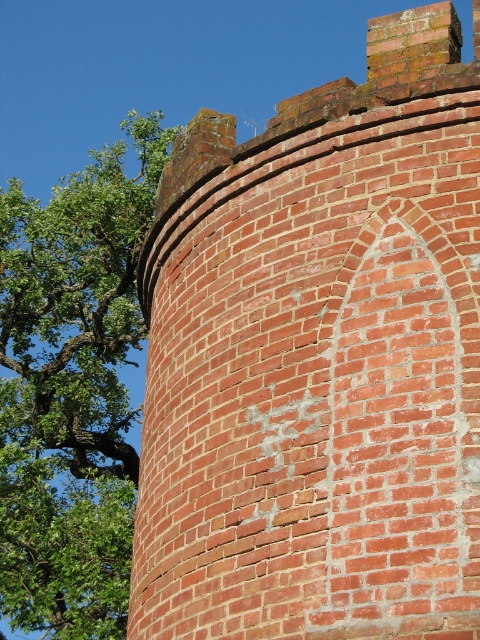
Question: Which object is closer to the camera taking this photo?

Choices:
 (A) red brick wall at center
 (B) green leafy tree at upper left

Answer: (A)

Question: Is red brick wall at center positioned in front of green leafy tree at upper left?

Choices:
 (A) no
 (B) yes

Answer: (B)

Question: Which point is farther to the camera?

Choices:
 (A) coord(50,612)
 (B) coord(298,205)

Answer: (A)

Question: Is red brick wall at center bigger than green leafy tree at upper left?

Choices:
 (A) no
 (B) yes

Answer: (A)

Question: Considering the relative positions of red brick wall at center and green leafy tree at upper left in the image provided, where is red brick wall at center located with respect to green leafy tree at upper left?

Choices:
 (A) right
 (B) left

Answer: (A)